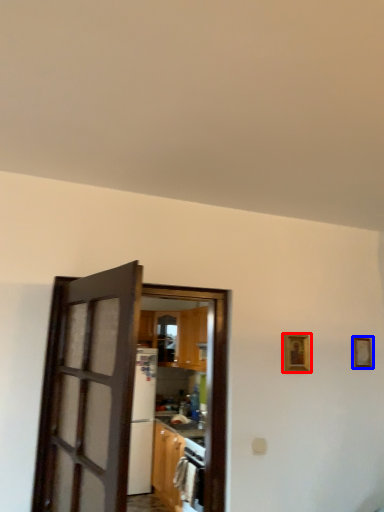
Question: Which object is closer to the camera taking this photo, picture frame (highlighted by a red box) or picture frame (highlighted by a blue box)?

Choices:
 (A) picture frame
 (B) picture frame

Answer: (A)